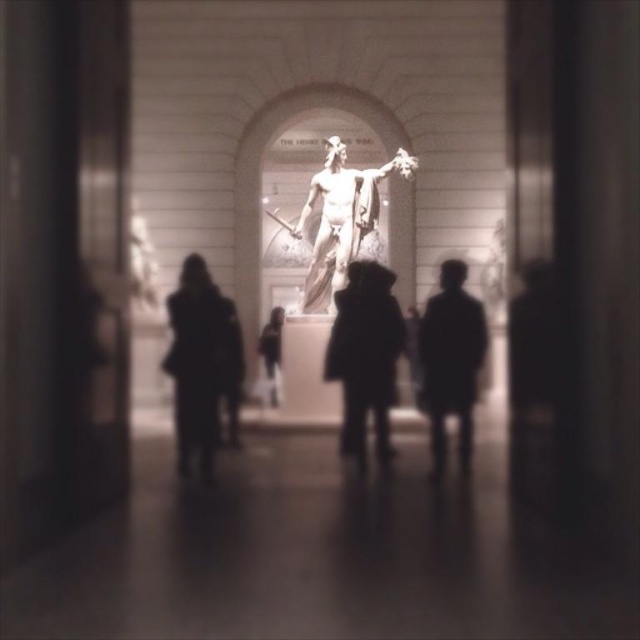
Question: Is black matte coat at center above dark fabric coat at center?

Choices:
 (A) yes
 (B) no

Answer: (B)

Question: Which point is farther from the camera taking this photo?

Choices:
 (A) (346, 257)
 (B) (445, 404)
 (C) (192, 253)
 (D) (236, 308)

Answer: (C)

Question: Is polished bronze statue at center closer to camera compared to dark fabric coat at center?

Choices:
 (A) yes
 (B) no

Answer: (A)

Question: Which point is closer to the camera?

Choices:
 (A) dark fabric coat at center
 (B) polished bronze statue at center
 (C) black matte coat at center

Answer: (C)

Question: Which object is farther from the camera taking this photo?

Choices:
 (A) dark wool coat at center
 (B) polished bronze statue at center

Answer: (B)

Question: Can you confirm if silhouette coat at center is wider than dark wool coat at center?

Choices:
 (A) yes
 (B) no

Answer: (A)